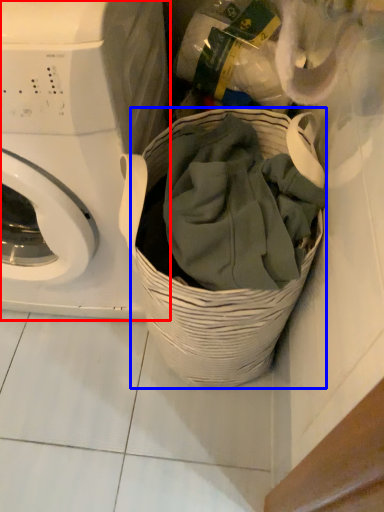
Question: Which of the following is the closest to the observer, washing machine (highlighted by a red box) or basket (highlighted by a blue box)?

Choices:
 (A) washing machine
 (B) basket

Answer: (A)